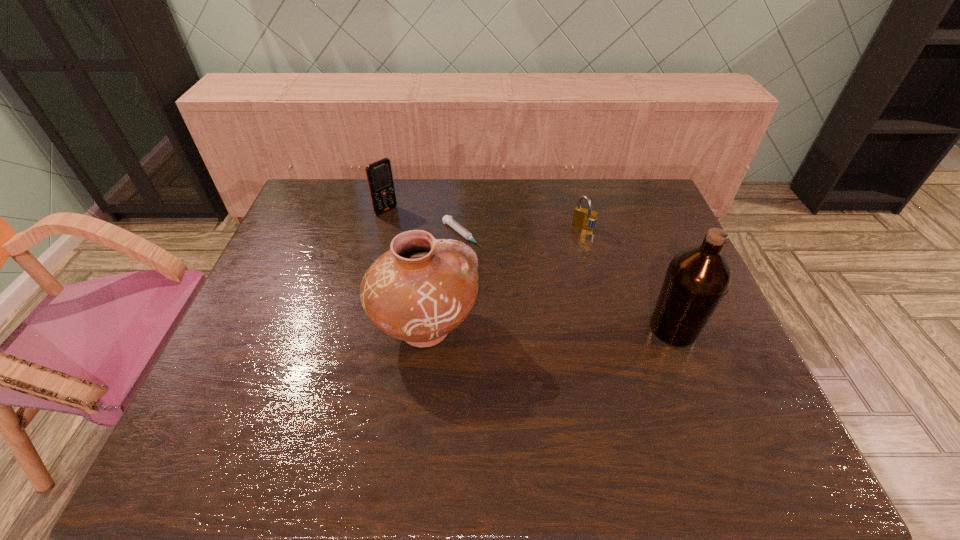
Where is `pottery`? pottery is located at coordinates (421, 289).

Where is `olive oil`? The height and width of the screenshot is (540, 960). olive oil is located at coordinates (697, 278).

At what (x,y) coordinates should I click in order to perform the action: click on the fourth object from left to right. Please return your answer as a coordinate pair (x, y). This screenshot has height=540, width=960. Looking at the image, I should click on (586, 219).

I want to click on padlock, so click(x=586, y=219).

The width and height of the screenshot is (960, 540). Identify the location of the leftmost object. (379, 176).

In order to click on the farthest object in this screenshot , I will do `click(379, 176)`.

The width and height of the screenshot is (960, 540). What are the coordinates of `the shortest object` in the screenshot? It's located at (467, 235).

Where is `vacant space located 0.380m on the side of the pottery with the handle`? This screenshot has width=960, height=540. vacant space located 0.380m on the side of the pottery with the handle is located at coordinates (631, 328).

Locate an element on the screen. The height and width of the screenshot is (540, 960). vacant space situated 0.110m on the side with the combination dials of the padlock is located at coordinates 568,255.

Identify the location of vacant region located 0.200m on the side with the combination dials of the padlock. The width and height of the screenshot is (960, 540). (558, 275).